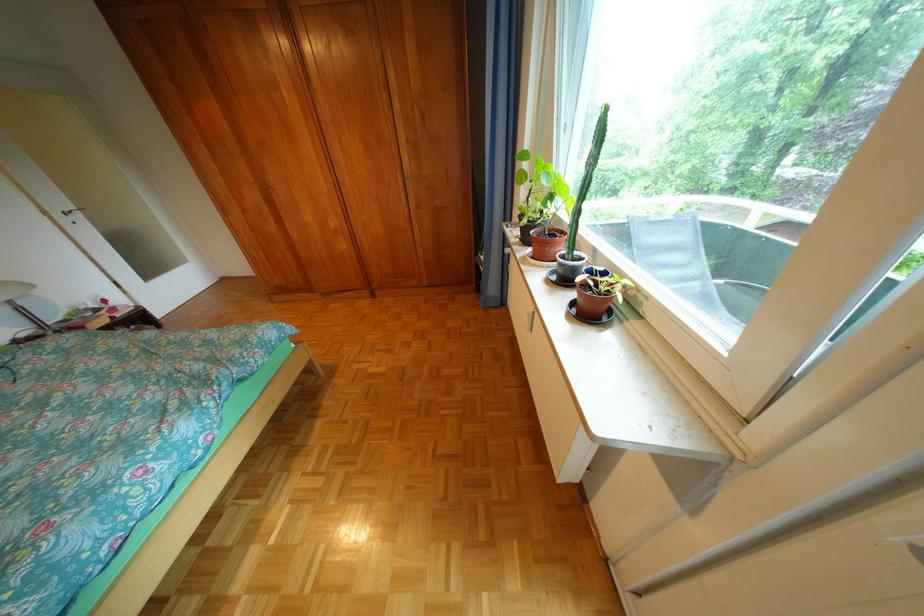
Where would you pull the silver cabinet handle? Please return your answer as a coordinate pair (x, y).

(529, 320)